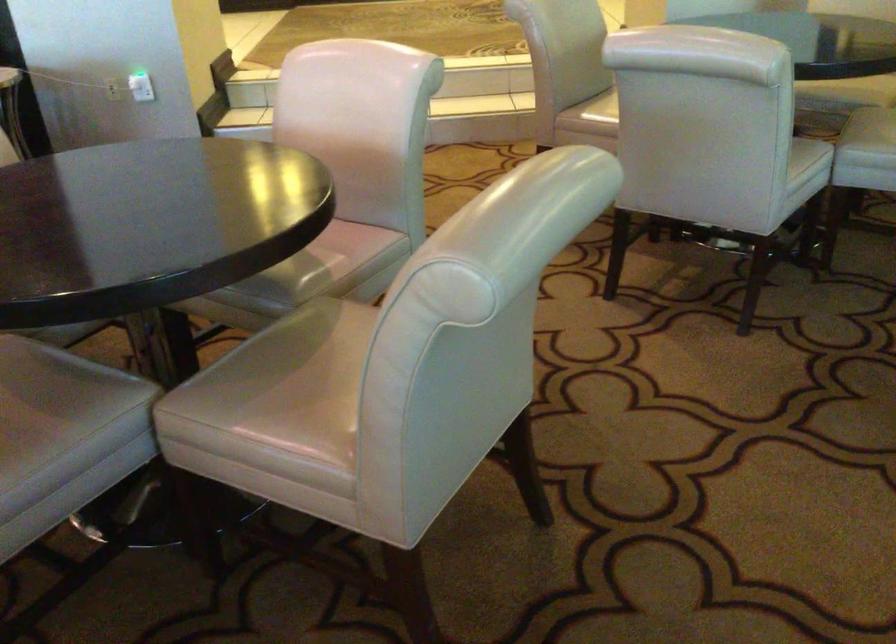
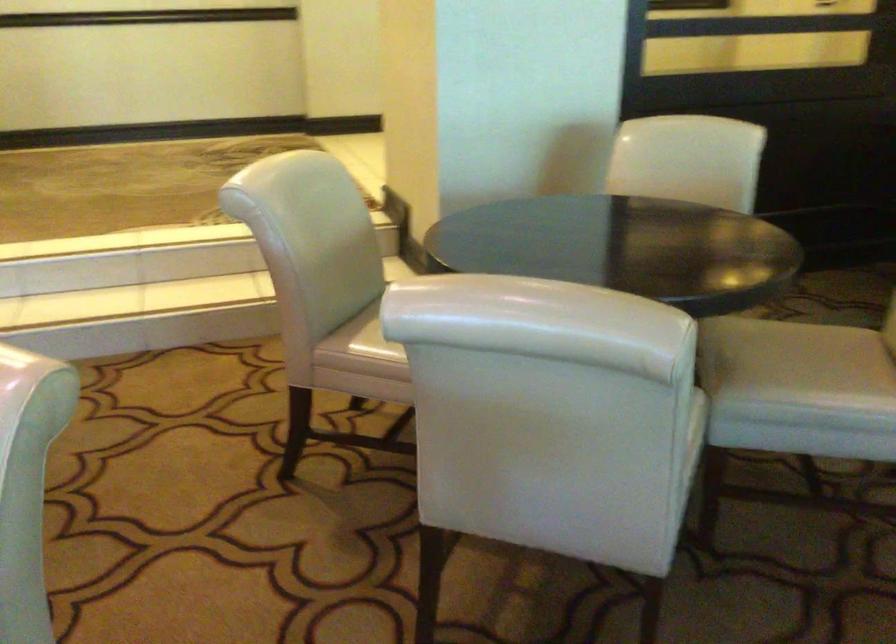
Question: Which direction would the cameraman need to move to produce the second image? Reply with the corresponding letter.

Choices:
 (A) Left
 (B) Right
 (C) Forward
 (D) Backward

Answer: (C)